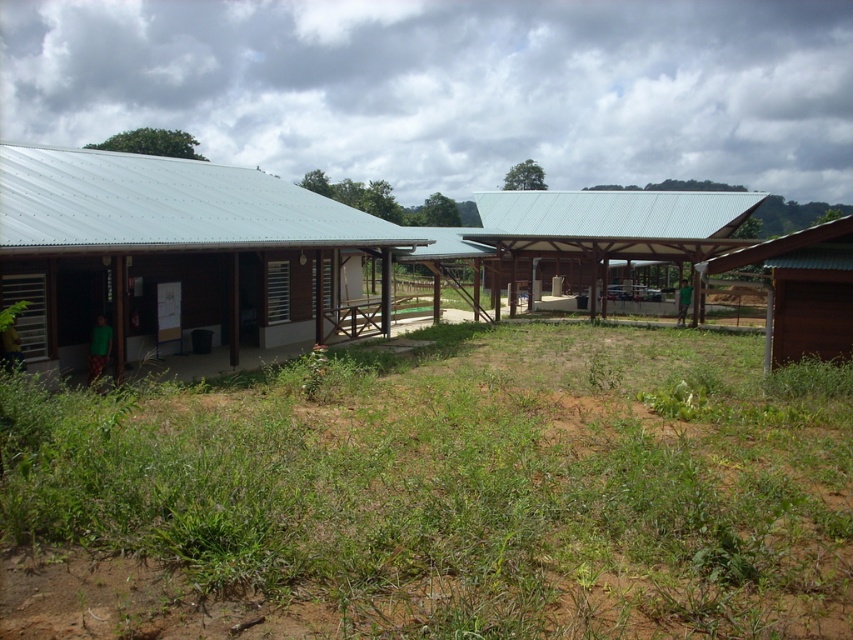
Question: Estimate the real-world distances between objects in this image. Which object is farther from the green grass at center?

Choices:
 (A) brown wooden barn at right
 (B) metallic roof at center

Answer: (B)

Question: Can you confirm if green grass at center is positioned to the right of metallic corrugated roof at left?

Choices:
 (A) no
 (B) yes

Answer: (B)

Question: Which point is closer to the camera?

Choices:
 (A) (207, 275)
 (B) (804, 317)
 (C) (587, 209)

Answer: (B)

Question: Observing the image, what is the correct spatial positioning of metallic roof at center in reference to brown wooden barn at right?

Choices:
 (A) below
 (B) above

Answer: (B)

Question: From the image, what is the correct spatial relationship of metallic corrugated roof at left in relation to metallic roof at center?

Choices:
 (A) above
 (B) below

Answer: (B)

Question: Based on their relative distances, which object is farther from the brown wooden barn at right?

Choices:
 (A) metallic roof at center
 (B) green grass at center
 (C) metallic corrugated roof at left

Answer: (C)